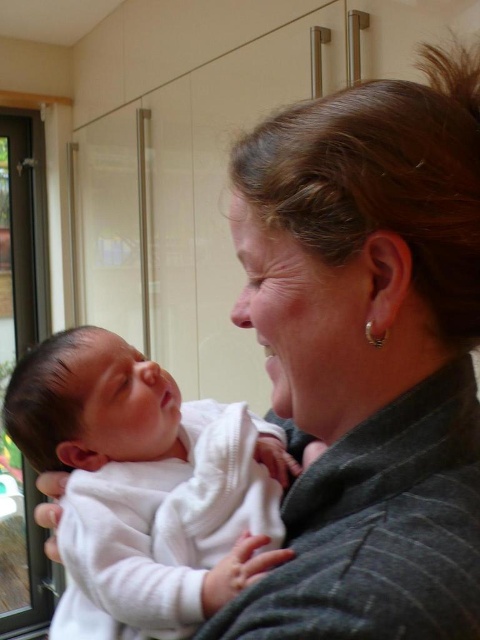
Question: Does white soft baby at center appear over transparent glass screen door at left?

Choices:
 (A) no
 (B) yes

Answer: (A)

Question: Can you confirm if white soft baby at center is positioned to the right of transparent glass screen door at left?

Choices:
 (A) no
 (B) yes

Answer: (B)

Question: Which point is farther to the camera?

Choices:
 (A) (96, 456)
 (B) (9, 572)

Answer: (B)

Question: Can you confirm if white soft baby at center is thinner than transparent glass screen door at left?

Choices:
 (A) yes
 (B) no

Answer: (B)

Question: Which point appears closest to the camera in this image?

Choices:
 (A) (x=272, y=525)
 (B) (x=28, y=257)

Answer: (A)